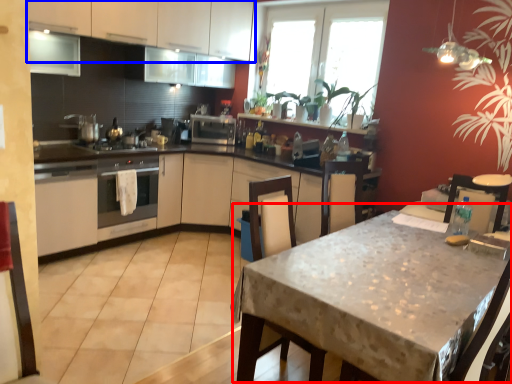
Question: Which object is closer to the camera taking this photo, round table (highlighted by a red box) or cabinetry (highlighted by a blue box)?

Choices:
 (A) round table
 (B) cabinetry

Answer: (A)